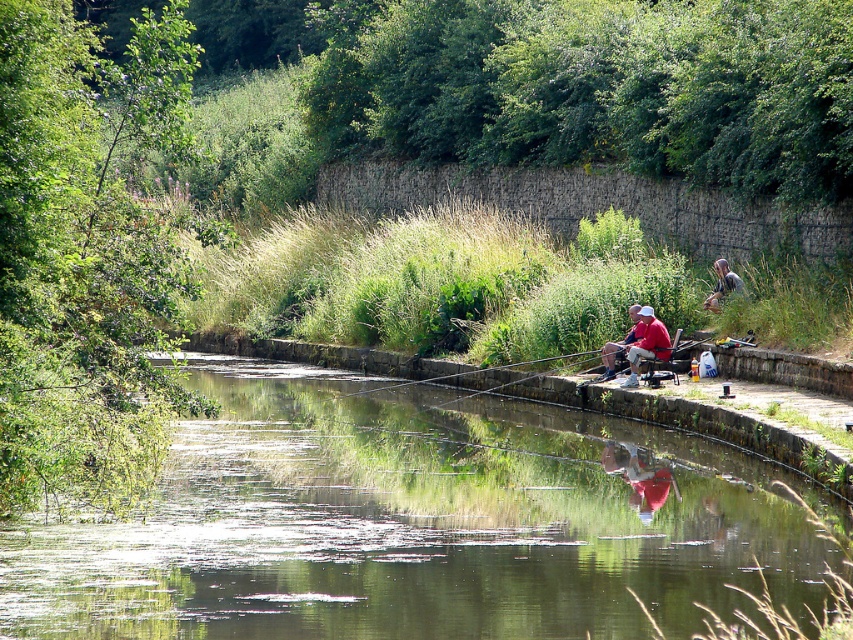
Between point (631, 349) and point (643, 326), which one is positioned behind?

The point (643, 326) is behind.

Which is above, red fabric shirt at center or matte red shirt at center?

red fabric shirt at center is above.

Is point (633, 353) positioned before point (619, 344)?

Yes, point (633, 353) is in front of point (619, 344).

I want to click on red fabric shirt at center, so click(647, 344).

Is green grassy stream at center positioned behind red fabric shirt at center?

No, green grassy stream at center is closer to the viewer.

Which is behind, point (625, 464) or point (641, 316)?

The point (641, 316) is behind.

This screenshot has width=853, height=640. Identify the location of green grassy stream at center. (415, 522).

Who is more forward, [659,337] or [544,374]?

Point [659,337]

Is red fabric shirt at center taller than smooth wooden rod at center?

Yes.

Which is in front, point (651, 342) or point (424, 380)?

Point (651, 342) is in front.

Where is `red fabric shirt at center`? This screenshot has width=853, height=640. red fabric shirt at center is located at coordinates (647, 344).